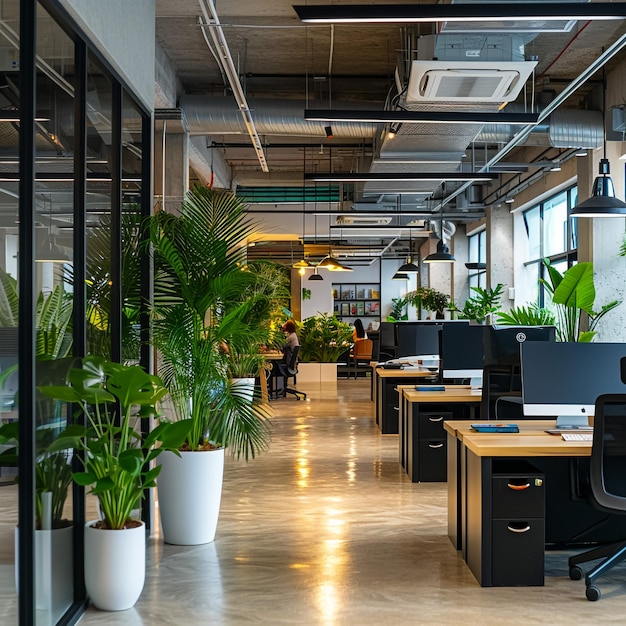
At what (x,y) coordinates should I click in order to perform the action: click on handles on the desk drawers. Please return your answer as a coordinate pair (x, y). The height and width of the screenshot is (626, 626). Looking at the image, I should click on (519, 531), (520, 483).